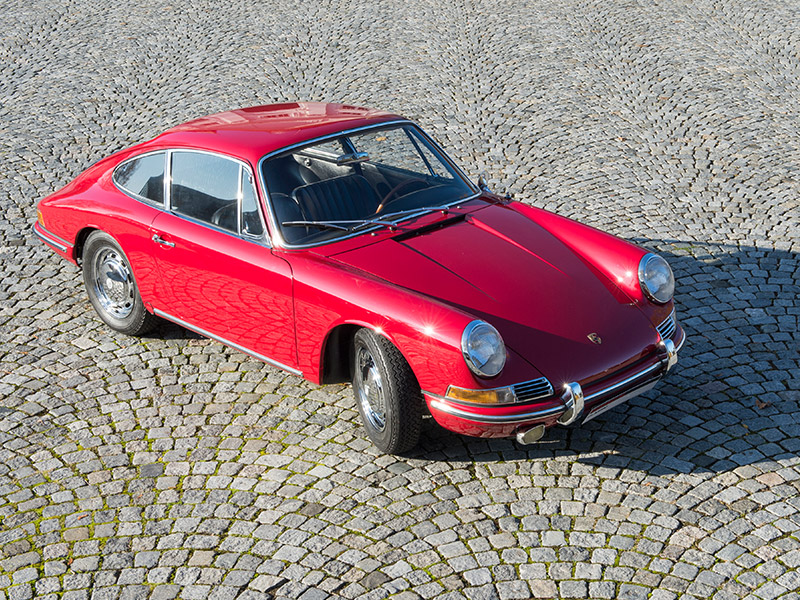
This screenshot has width=800, height=600. I want to click on door handle, so click(160, 240).